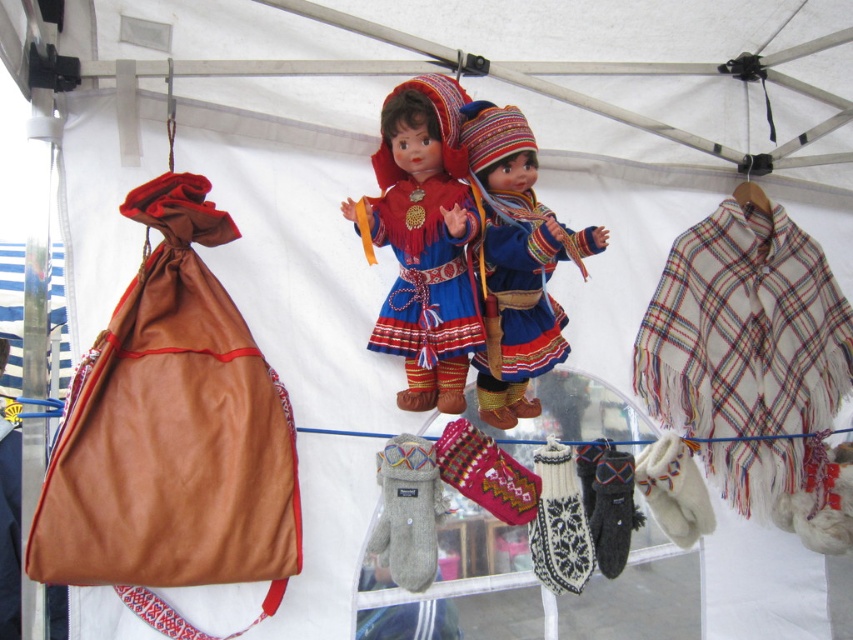
Based on the photo, you are a customer at the market and want to locate the white plaid shawl at upper right. Based on the coordinates provided, can you determine its position relative to the other items in the scene?

The white plaid shawl at upper right is located at coordinates point (744,330), which places it in the upper right area of the scene.

Looking at the white plaid shawl at upper right and the matte blue fabric doll at center, which object is positioned to the right of the other?

The white plaid shawl at upper right is to the right of the matte blue fabric doll at center.

You are a customer at the market and want to know which item is higher up between the white plaid shawl at upper right and the matte blue fabric doll at center. Can you determine this based on their positions?

The white plaid shawl at upper right is much taller than the matte blue fabric doll at center, so it is positioned higher up.